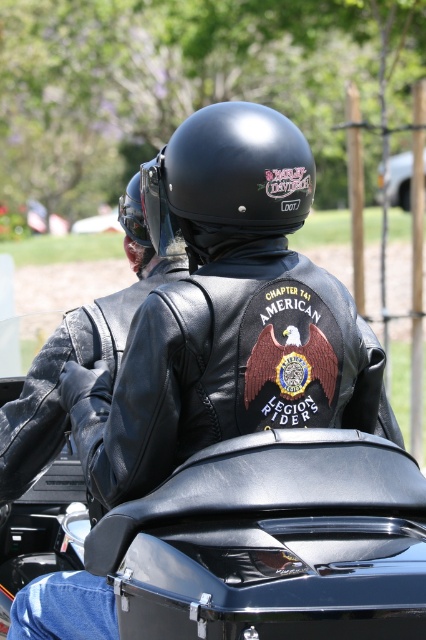
Question: Is black leather jacket at center further to the viewer compared to black leather jacket at upper center?

Choices:
 (A) yes
 (B) no

Answer: (B)

Question: Estimate the real-world distances between objects in this image. Which object is closer to the black leather jacket at center?

Choices:
 (A) matte black helmet at upper center
 (B) black leather jacket at upper center

Answer: (B)

Question: Which of these objects is positioned farthest from the black leather jacket at center?

Choices:
 (A) black leather motorcycle at center
 (B) matte black helmet at upper center
 (C) black leather jacket at upper center

Answer: (B)

Question: Can you confirm if black leather jacket at center is thinner than black matte helmet at center?

Choices:
 (A) yes
 (B) no

Answer: (B)

Question: Does black leather jacket at upper center come behind matte black helmet at upper center?

Choices:
 (A) yes
 (B) no

Answer: (B)

Question: Which object is positioned closest to the black leather motorcycle at center?

Choices:
 (A) black leather jacket at upper center
 (B) matte black helmet at upper center
 (C) black matte helmet at center
 (D) black leather jacket at center

Answer: (D)